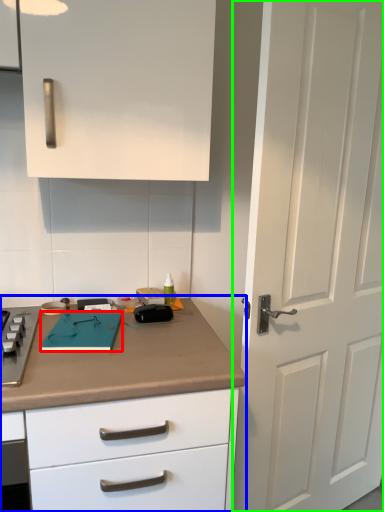
Question: Which object is the closest to the notepad (highlighted by a red box)? Choose among these: countertop (highlighted by a blue box) or door (highlighted by a green box).

Choices:
 (A) countertop
 (B) door

Answer: (A)